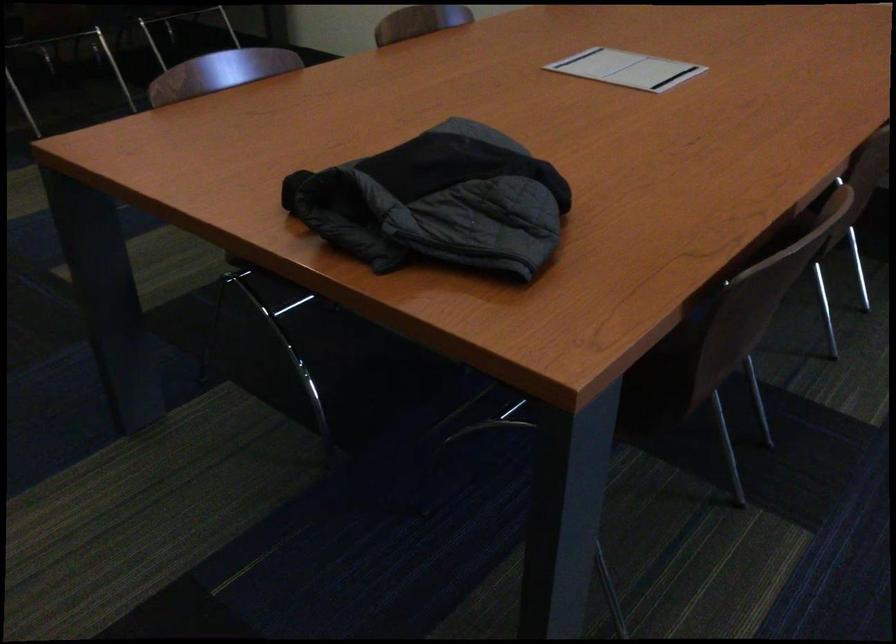
What do you see at coordinates (666, 386) in the screenshot?
I see `the brown chair sitting surface` at bounding box center [666, 386].